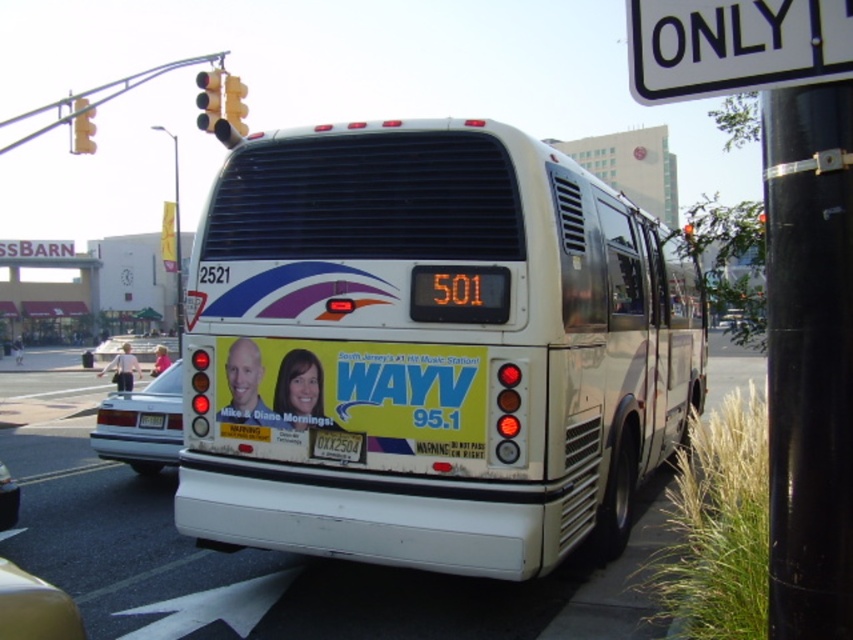
Question: Which object appears closest to the camera in this image?

Choices:
 (A) silver metallic sedan at lower left
 (B) yellow glass traffic light at upper center

Answer: (B)

Question: Can you confirm if white plastic sign at upper right is bigger than yellow glass traffic light at upper left?

Choices:
 (A) yes
 (B) no

Answer: (B)

Question: Among these points, which one is nearest to the camera?

Choices:
 (A) (798, 180)
 (B) (693, 243)

Answer: (A)

Question: Which point is closer to the camera?

Choices:
 (A) (119, 451)
 (B) (680, 97)

Answer: (B)

Question: Where is white glossy tour bus at center located in relation to white plastic sign at upper right in the image?

Choices:
 (A) left
 (B) right

Answer: (B)

Question: Is white glossy tour bus at center above metallic silver car at lower left?

Choices:
 (A) no
 (B) yes

Answer: (B)